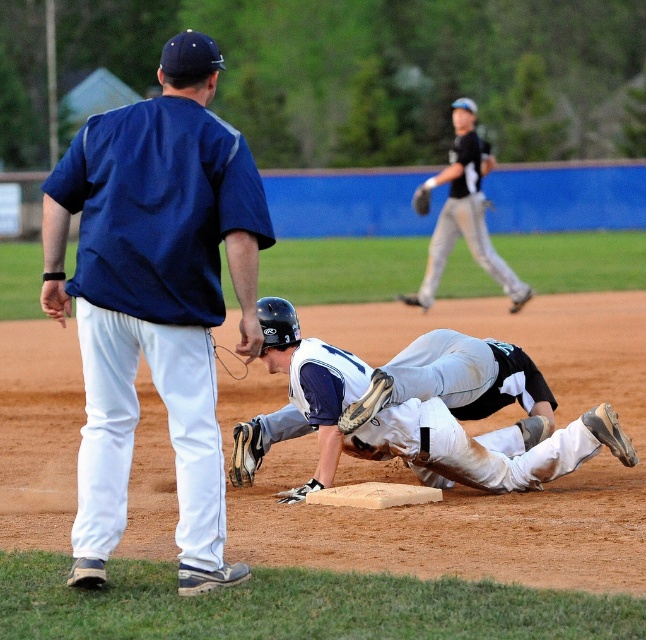
Does black jersey at upper right appear on the right side of brown leather glove at center?

Indeed, black jersey at upper right is positioned on the right side of brown leather glove at center.

Does black jersey at upper right lie behind brown leather glove at center?

That is True.

Who is more forward, (477,147) or (421,200)?

Point (477,147)

The width and height of the screenshot is (646, 640). Find the location of `black jersey at upper right`. black jersey at upper right is located at coordinates click(x=464, y=212).

Is white matte uniform at center positioned before brown leather glove at center?

Yes, it is in front of brown leather glove at center.

Is point (309, 403) farther from camera compared to point (424, 211)?

No, (309, 403) is in front of (424, 211).

Where is `white matte uniform at center`? white matte uniform at center is located at coordinates (428, 410).

You are a GUI agent. You are given a task and a screenshot of the screen. Output one action in this format:
    pyautogui.click(x=<x>, y=<y>)
    Task: Click on the white matte uniform at center
    This screenshot has width=646, height=640.
    Given the screenshot: What is the action you would take?
    pyautogui.click(x=428, y=410)

Can you confirm if blue fabric shirt at upper left is shorter than black jersey at upper right?

Yes, blue fabric shirt at upper left is shorter than black jersey at upper right.

How distant is blue fabric shirt at upper left from black jersey at upper right?

A distance of 12.06 meters exists between blue fabric shirt at upper left and black jersey at upper right.

Is point (81, 310) in front of point (459, 157)?

Yes, point (81, 310) is in front of point (459, 157).

Identify the location of blue fabric shirt at upper left. The image size is (646, 640). (154, 298).